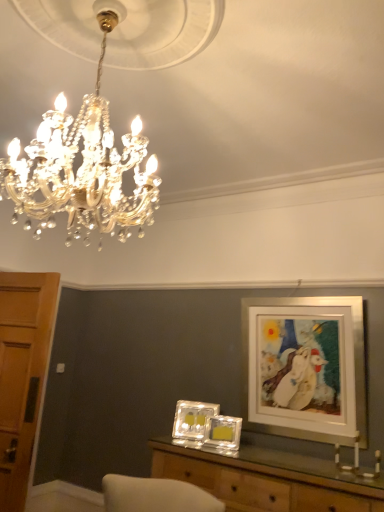
Where is `free space in front of translucent glass picture frame at center, which appears as the 2th picture frame when viewed from the right`? free space in front of translucent glass picture frame at center, which appears as the 2th picture frame when viewed from the right is located at coordinates (225, 453).